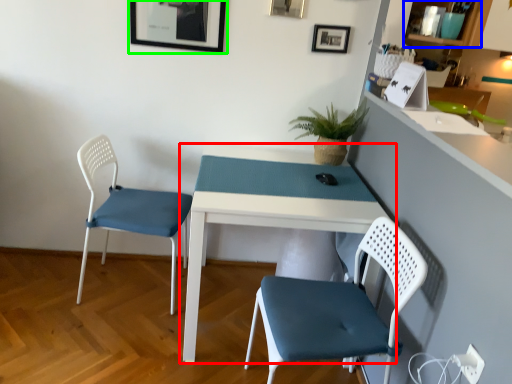
Question: Based on their relative distances, which object is nearer to table (highlighted by a red box)? Choose from shelf (highlighted by a blue box) and picture frame (highlighted by a green box).

Choices:
 (A) shelf
 (B) picture frame

Answer: (B)